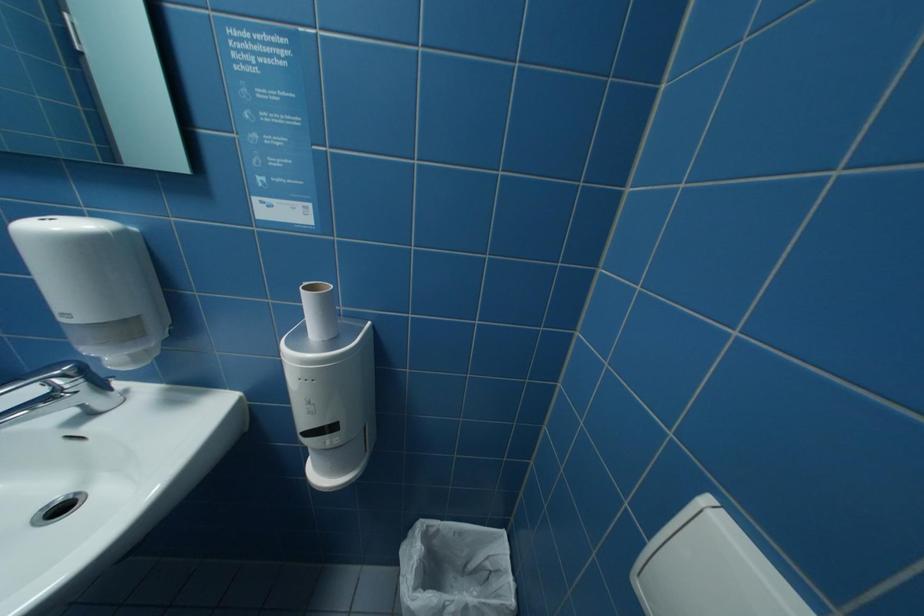
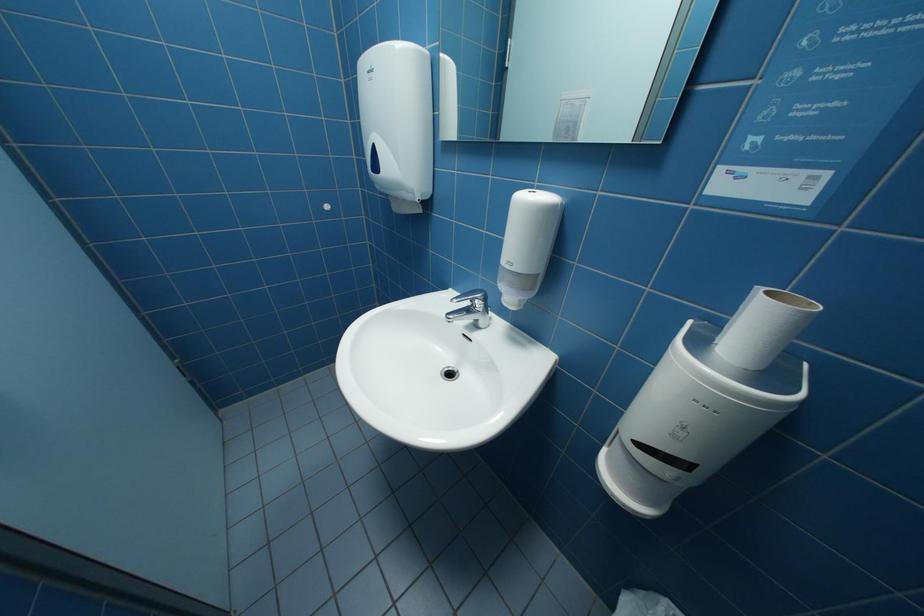
Question: How did the camera likely rotate?

Choices:
 (A) Left
 (B) Right
 (C) Up
 (D) Down

Answer: (A)